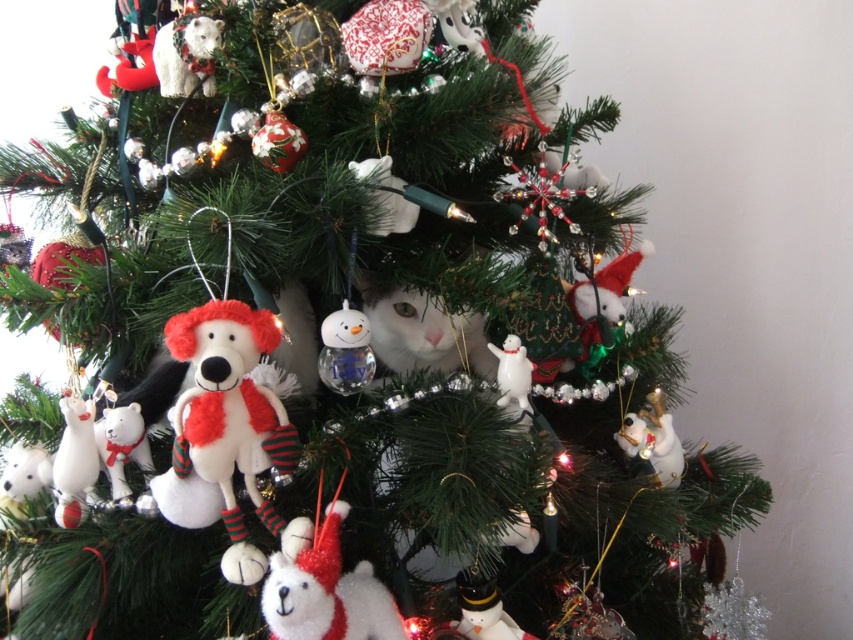
You are a child looking at the Christmas tree and want to find both the white plush dog at center and the white fluffy cat at center. Which one is lower on the tree?

The white plush dog at center is located below the white fluffy cat at center, so it is lower on the tree.

What are the coordinates of the white plush dog at center?

The white plush dog at center is located at coordinates point [229,428].

What object is located at the coordinates point (229, 428)?

The white plush dog at center is located at the coordinates point (229, 428).